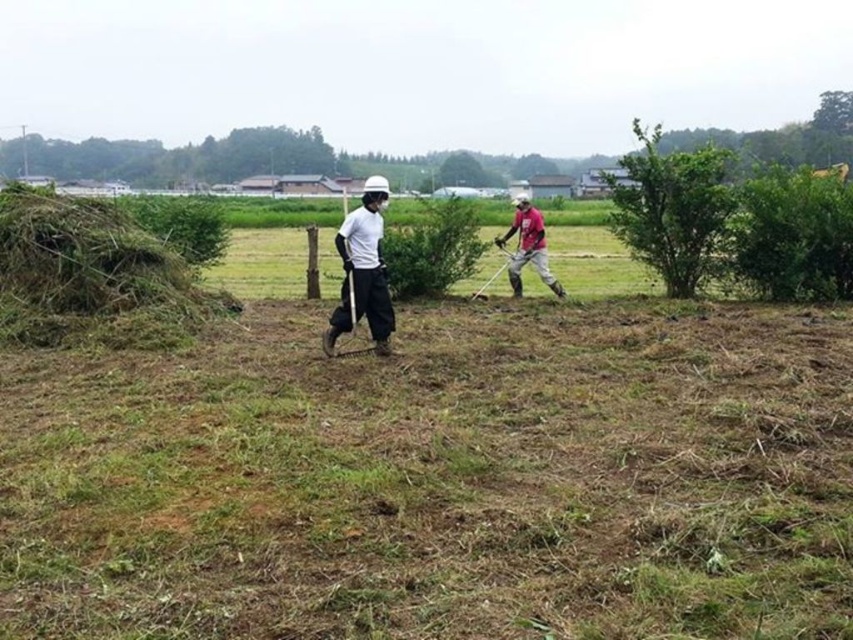
Question: Is white matte shirt at center above matte pink shirt at center?

Choices:
 (A) yes
 (B) no

Answer: (B)

Question: Is brown dry grass at center smaller than white matte shirt at center?

Choices:
 (A) no
 (B) yes

Answer: (B)

Question: Is white matte shirt at center positioned in front of matte pink shirt at center?

Choices:
 (A) no
 (B) yes

Answer: (B)

Question: Which object is farther from the camera taking this photo?

Choices:
 (A) green leafy hedge at right
 (B) matte pink shirt at center

Answer: (B)

Question: Based on their relative distances, which object is farther from the green leafy hedge at right?

Choices:
 (A) matte pink shirt at center
 (B) white matte shirt at center
 (C) brown dry grass at center

Answer: (C)

Question: Which of these objects is positioned farthest from the matte pink shirt at center?

Choices:
 (A) white matte shirt at center
 (B) green leafy hedge at right

Answer: (A)